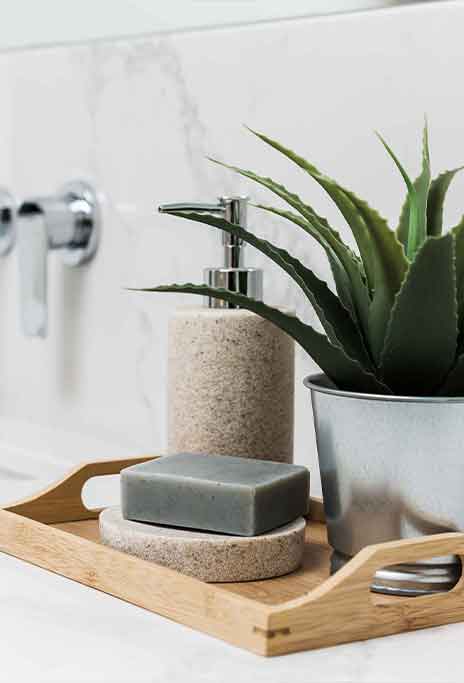
This screenshot has width=464, height=683. Find the location of `faucet handle`. faucet handle is located at coordinates (41, 234).